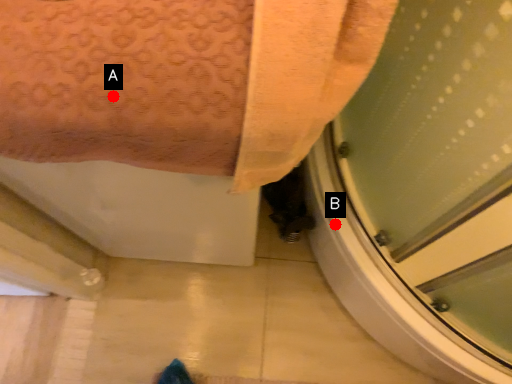
Question: Two points are circled on the image, labeled by A and B beside each circle. Which point is farther to the camera?

Choices:
 (A) A is further
 (B) B is further

Answer: (B)